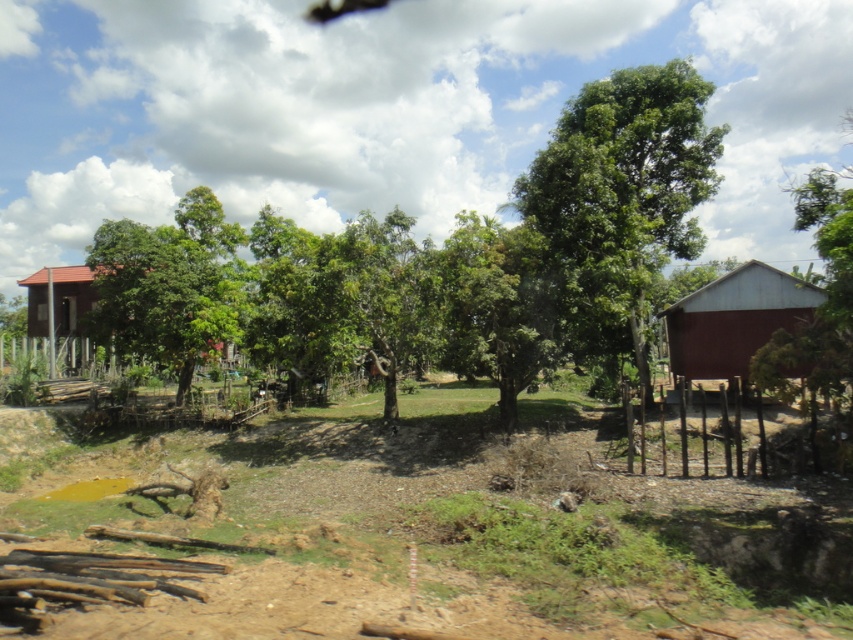
Is brown soil at center below red wood hut at right?

Indeed, brown soil at center is positioned under red wood hut at right.

The height and width of the screenshot is (640, 853). Describe the element at coordinates (439, 528) in the screenshot. I see `brown soil at center` at that location.

The width and height of the screenshot is (853, 640). In order to click on brown soil at center in this screenshot , I will do `click(439, 528)`.

Is point (310, 467) farther from viewer compared to point (41, 300)?

No, (310, 467) is closer to viewer.

Is point (544, 540) positioned in front of point (51, 333)?

Yes.

Image resolution: width=853 pixels, height=640 pixels. Identify the location of brown soil at center. (439, 528).

Which is above, green leafy tree at center or red wood hut at right?

green leafy tree at center is above.

Is green leafy tree at center below red wood hut at right?

No, green leafy tree at center is not below red wood hut at right.

You are a GUI agent. You are given a task and a screenshot of the screen. Output one action in this format:
    pyautogui.click(x=<x>, y=<y>)
    Task: Click on the green leafy tree at center
    
    Given the screenshot: What is the action you would take?
    pyautogui.click(x=621, y=193)

The width and height of the screenshot is (853, 640). Find the location of `green leafy tree at center`. green leafy tree at center is located at coordinates (621, 193).